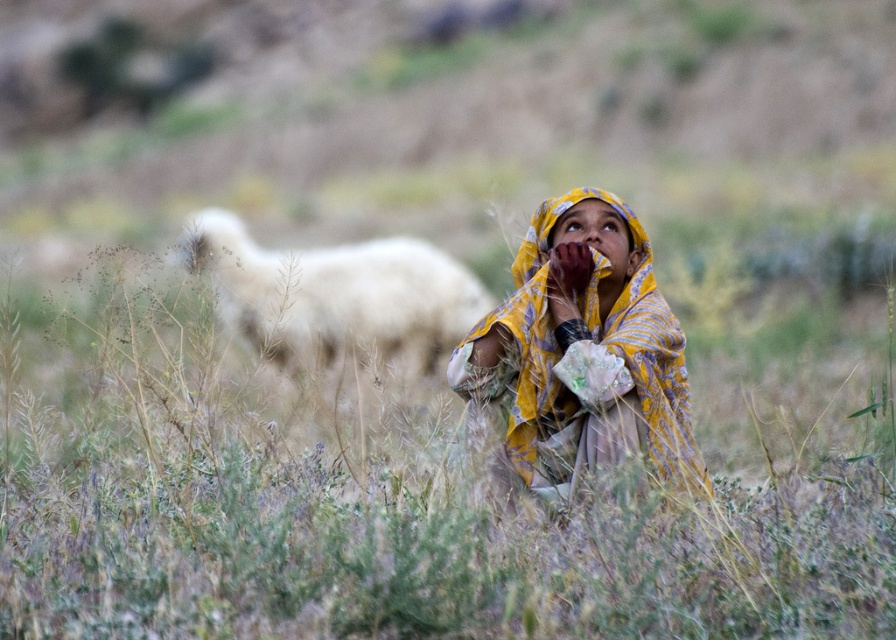
Question: Which of the following is the farthest from the observer?

Choices:
 (A) white woolly sheep at center
 (B) green grass at center
 (C) yellow printed scarf at center

Answer: (C)

Question: Which point is closer to the camera?

Choices:
 (A) white woolly sheep at center
 (B) green grass at center
 (C) yellow printed scarf at center

Answer: (B)

Question: Which is nearer to the green grass at center?

Choices:
 (A) white woolly sheep at center
 (B) yellow printed scarf at center

Answer: (B)

Question: Is green grass at center positioned at the back of white woolly sheep at center?

Choices:
 (A) yes
 (B) no

Answer: (B)

Question: Considering the relative positions of green grass at center and yellow printed scarf at center in the image provided, where is green grass at center located with respect to yellow printed scarf at center?

Choices:
 (A) below
 (B) above

Answer: (A)

Question: Where is green grass at center located in relation to yellow printed scarf at center in the image?

Choices:
 (A) above
 (B) below

Answer: (B)